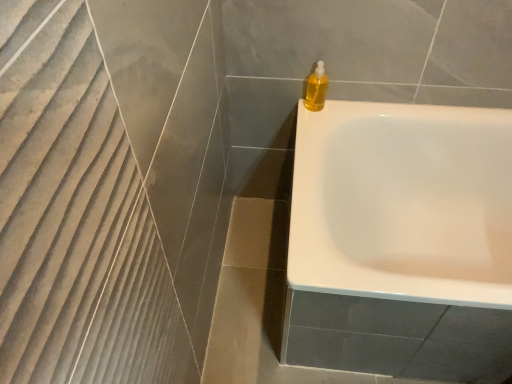
Describe the element at coordinates (403, 203) in the screenshot. I see `white glossy bathtub at upper right` at that location.

Identify the location of white glossy bathtub at upper right. This screenshot has width=512, height=384. [403, 203].

In order to face translucent yellow liquid at upper right, should I rotate leftwards or rightwards?

You should look right and rotate roughly 8.370 degrees.

Describe the element at coordinates (316, 88) in the screenshot. The height and width of the screenshot is (384, 512). I see `translucent yellow liquid at upper right` at that location.

The image size is (512, 384). Find the location of `translucent yellow liquid at upper right`. translucent yellow liquid at upper right is located at coordinates (316, 88).

Locate an element on the screen. white glossy bathtub at upper right is located at coordinates (403, 203).

Which is more to the right, translucent yellow liquid at upper right or white glossy bathtub at upper right?

white glossy bathtub at upper right.

Is translucent yellow liquid at upper right closer to the viewer compared to white glossy bathtub at upper right?

No, translucent yellow liquid at upper right is further to the viewer.

Is point (312, 100) positioned after point (479, 203)?

That is False.

From the image's perspective, would you say translucent yellow liquid at upper right is positioned over white glossy bathtub at upper right?

Yes, from the image's perspective, translucent yellow liquid at upper right is on top of white glossy bathtub at upper right.

From a real-world perspective, which object rests below the other?

In real-world perspective, white glossy bathtub at upper right is lower.

Which object is wider, translucent yellow liquid at upper right or white glossy bathtub at upper right?

With larger width is white glossy bathtub at upper right.

Considering the sizes of translucent yellow liquid at upper right and white glossy bathtub at upper right in the image, is translucent yellow liquid at upper right taller or shorter than white glossy bathtub at upper right?

In the image, translucent yellow liquid at upper right appears to be shorter than white glossy bathtub at upper right.

Is translucent yellow liquid at upper right bigger or smaller than white glossy bathtub at upper right?

Considering their sizes, translucent yellow liquid at upper right takes up less space than white glossy bathtub at upper right.

Is translucent yellow liquid at upper right outside of white glossy bathtub at upper right?

Yes, translucent yellow liquid at upper right is located beyond the bounds of white glossy bathtub at upper right.

Is translucent yellow liquid at upper right in contact with white glossy bathtub at upper right?

There is a gap between translucent yellow liquid at upper right and white glossy bathtub at upper right.

Is translucent yellow liquid at upper right positioned with its back to white glossy bathtub at upper right?

No.

Locate an element on the screen. This screenshot has width=512, height=384. bathtub below the translucent yellow liquid at upper right (from a real-world perspective) is located at coordinates (403, 203).

Considering the relative positions of white glossy bathtub at upper right and translucent yellow liquid at upper right in the image provided, is white glossy bathtub at upper right to the left of translucent yellow liquid at upper right from the viewer's perspective?

In fact, white glossy bathtub at upper right is to the right of translucent yellow liquid at upper right.

Which object is more forward, white glossy bathtub at upper right or translucent yellow liquid at upper right?

Positioned in front is white glossy bathtub at upper right.

Is point (490, 149) farther from camera compared to point (309, 82)?

Yes, point (490, 149) is behind point (309, 82).

From the image's perspective, is white glossy bathtub at upper right under translucent yellow liquid at upper right?

Yes, from the image's perspective, white glossy bathtub at upper right is below translucent yellow liquid at upper right.

From a real-world perspective, is white glossy bathtub at upper right beneath translucent yellow liquid at upper right?

Yes, from a real-world perspective, white glossy bathtub at upper right is beneath translucent yellow liquid at upper right.

Which object is wider, white glossy bathtub at upper right or translucent yellow liquid at upper right?

Wider between the two is white glossy bathtub at upper right.

Who is shorter, white glossy bathtub at upper right or translucent yellow liquid at upper right?

Standing shorter between the two is translucent yellow liquid at upper right.

Who is bigger, white glossy bathtub at upper right or translucent yellow liquid at upper right?

With larger size is white glossy bathtub at upper right.

Can we say white glossy bathtub at upper right lies outside translucent yellow liquid at upper right?

Yes, white glossy bathtub at upper right is not within translucent yellow liquid at upper right.

Is white glossy bathtub at upper right far from translucent yellow liquid at upper right?

That's not correct — white glossy bathtub at upper right is a little close to translucent yellow liquid at upper right.

Based on the photo, is white glossy bathtub at upper right positioned with its back to translucent yellow liquid at upper right?

No.

Measure the distance between white glossy bathtub at upper right and translucent yellow liquid at upper right.

white glossy bathtub at upper right is 41.53 centimeters away from translucent yellow liquid at upper right.

In order to click on soap dispenser on the left of white glossy bathtub at upper right in this screenshot , I will do `click(316, 88)`.

At what (x,y) coordinates should I click in order to perform the action: click on soap dispenser behind the white glossy bathtub at upper right. Please return your answer as a coordinate pair (x, y). This screenshot has height=384, width=512. Looking at the image, I should click on (316, 88).

Locate an element on the screen. The image size is (512, 384). bathtub that appears in front of the translucent yellow liquid at upper right is located at coordinates (403, 203).